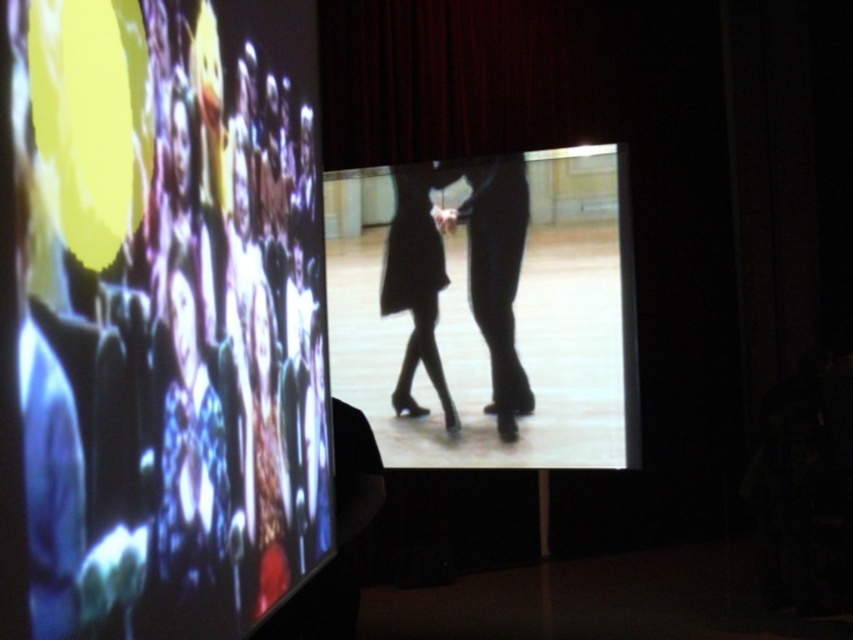
Question: Does matte black screen at upper left appear over black matte dress at center?

Choices:
 (A) yes
 (B) no

Answer: (B)

Question: Does matte black screen at upper left appear under black matte dress at center?

Choices:
 (A) no
 (B) yes

Answer: (B)

Question: Which of the following is the farthest from the observer?

Choices:
 (A) (453, 337)
 (B) (419, 307)
 (C) (274, 253)

Answer: (B)

Question: Can you confirm if matte black screen at upper left is smaller than black matte dress at center?

Choices:
 (A) no
 (B) yes

Answer: (A)

Question: Which object is farther from the camera taking this photo?

Choices:
 (A) silhouette dress at center
 (B) black matte dress at center
 (C) matte black screen at upper left

Answer: (B)

Question: Which point appears farthest from the camera in this image?

Choices:
 (A) (96, 428)
 (B) (454, 396)
 (C) (444, 276)

Answer: (B)